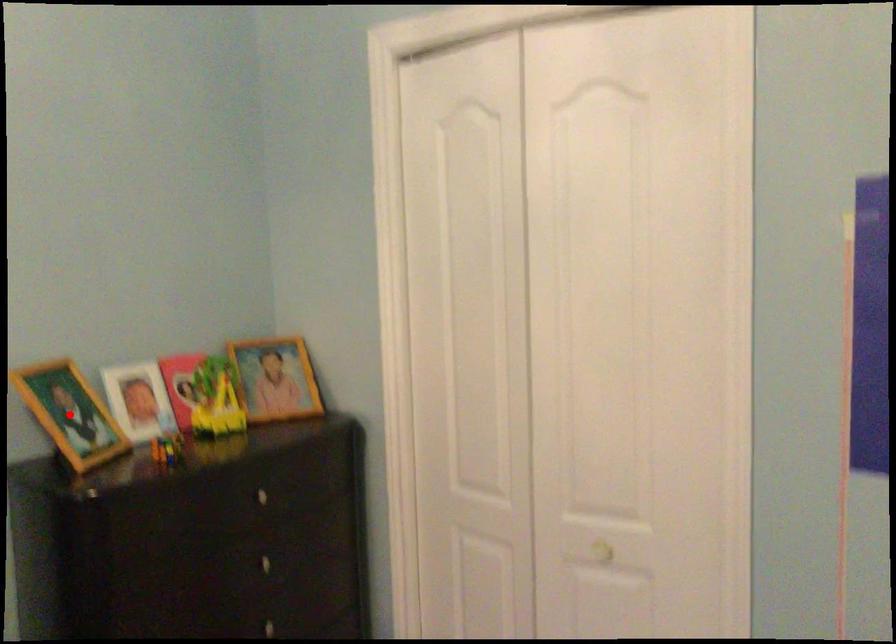
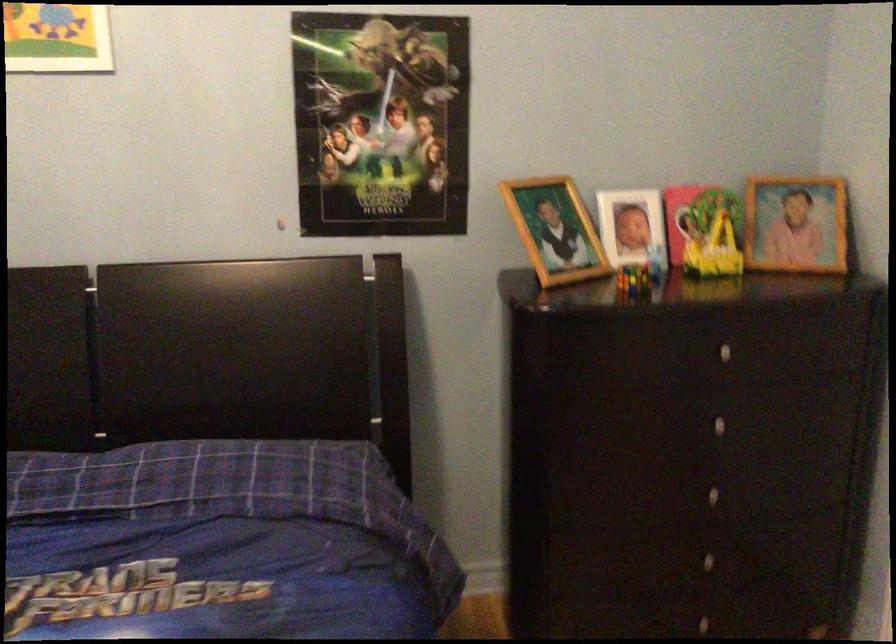
The point at the highlighted location is marked in the first image. Where is the corresponding point in the second image?

(555, 230)